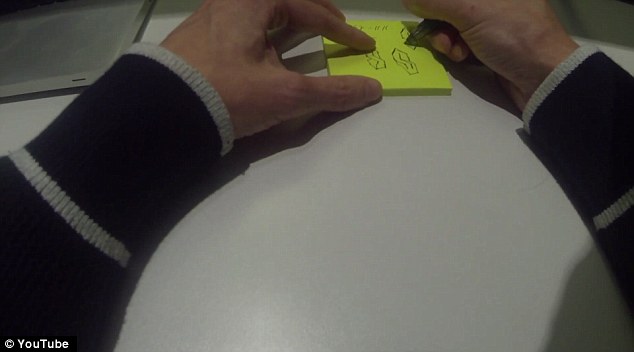
Locate an element on the screen. This screenshot has height=352, width=634. pen is located at coordinates (423, 29).